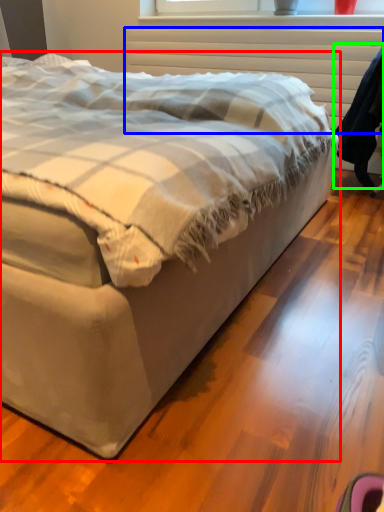
Question: Estimate the real-world distances between objects in this image. Which object is closer to bed (highlighted by a red box), radiator (highlighted by a blue box) or robe (highlighted by a green box)?

Choices:
 (A) radiator
 (B) robe

Answer: (B)